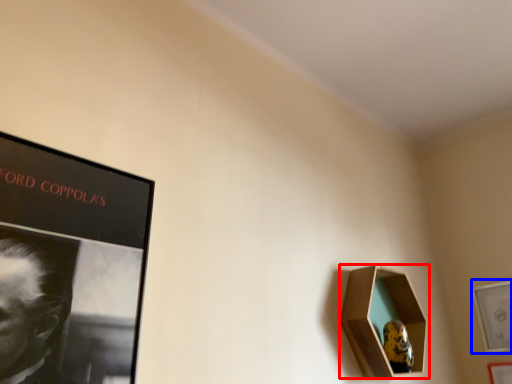
Question: Among these objects, which one is farthest to the camera, picture frame (highlighted by a red box) or picture frame (highlighted by a blue box)?

Choices:
 (A) picture frame
 (B) picture frame

Answer: (B)